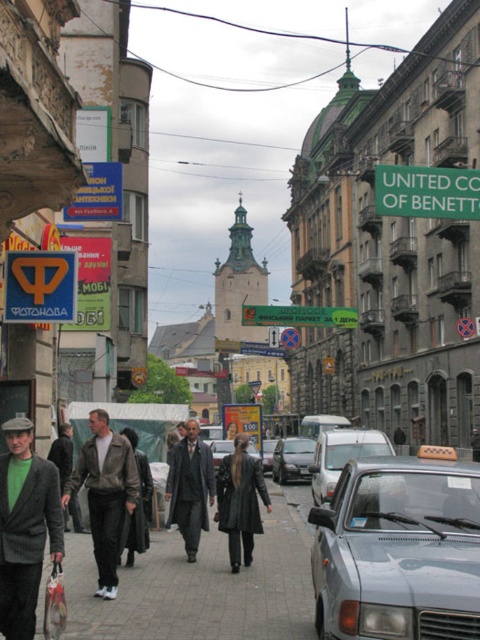
How much distance is there between paved stone sidewalk at center and green plastic signboard at upper right?

The distance of paved stone sidewalk at center from green plastic signboard at upper right is 74.64 feet.

Which is in front, point (241, 589) or point (397, 184)?

Point (241, 589)

At what (x,y) coordinates should I click in order to perform the action: click on paved stone sidewalk at center. Please return your answer as a coordinate pair (x, y). Looking at the image, I should click on (201, 586).

Does green woolen sweater at center appear on the left side of leather jacket at center?

Correct, you'll find green woolen sweater at center to the left of leather jacket at center.

How much distance is there between green woolen sweater at center and leather jacket at center?

green woolen sweater at center is 7.81 meters from leather jacket at center.

Between point (26, 545) and point (92, 490), which one is positioned in front?

Point (26, 545) is more forward.

The width and height of the screenshot is (480, 640). I want to click on green woolen sweater at center, so click(x=24, y=528).

In the scene shown: Is green woolen sweater at center smaller than dark gray leather coat at center?

Correct, green woolen sweater at center occupies less space than dark gray leather coat at center.

Is green woolen sweater at center thinner than dark gray leather coat at center?

Yes, green woolen sweater at center is thinner than dark gray leather coat at center.

Locate an element on the screen. Image resolution: width=480 pixels, height=640 pixels. green woolen sweater at center is located at coordinates (24, 528).